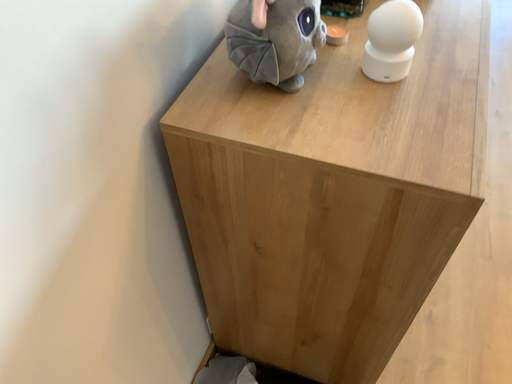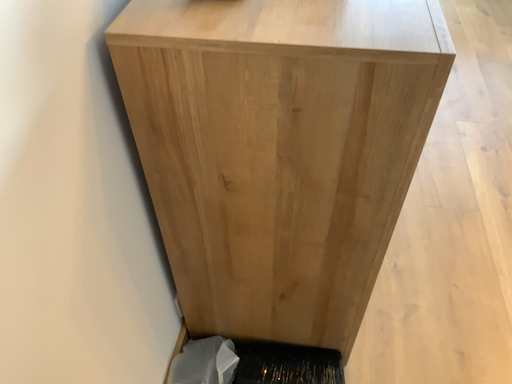
Question: How did the camera likely rotate when shooting the video?

Choices:
 (A) rotated right
 (B) rotated left

Answer: (A)